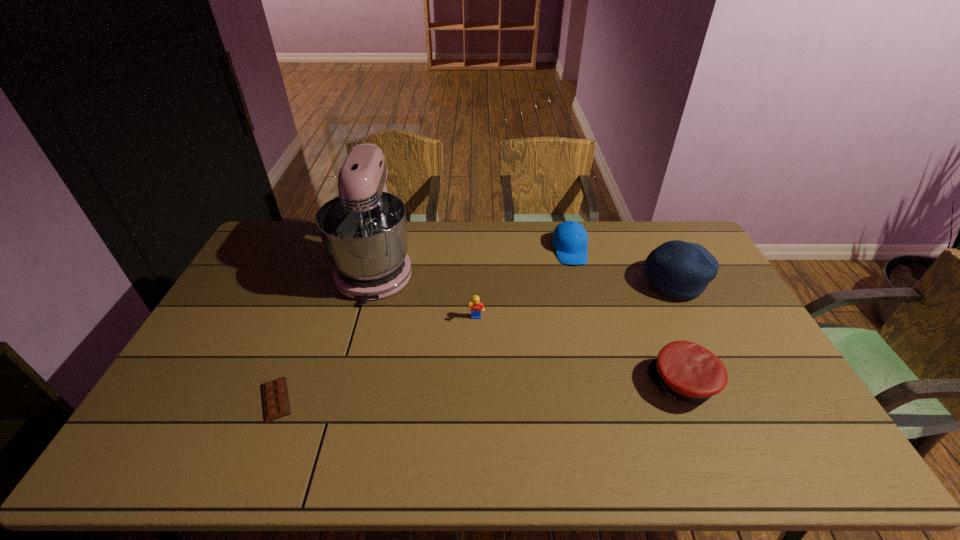
Where is `free location at the near edge`? This screenshot has width=960, height=540. free location at the near edge is located at coordinates (245, 463).

This screenshot has width=960, height=540. What are the coordinates of `vacant space at the left edge of the desktop` in the screenshot? It's located at (212, 361).

The width and height of the screenshot is (960, 540). Identify the location of vacant position at the right edge of the desktop. (700, 312).

Find the location of a particular element. vacant space that is in between the third object from left to right and the fifth shortest object is located at coordinates (574, 300).

What are the coordinates of `empty space that is in between the fourth object from right to left and the chocolate bar` in the screenshot? It's located at (376, 359).

Find the location of a particular element. free spot between the left cap and the nearer cap is located at coordinates (627, 316).

What are the coordinates of `empty space between the Lego and the right cap` in the screenshot? It's located at (580, 351).

The height and width of the screenshot is (540, 960). Identify the location of empty space that is in between the fourth farthest object and the skullcap. (574, 300).

Where is `free spot between the right cap and the chocolate bar`? This screenshot has width=960, height=540. free spot between the right cap and the chocolate bar is located at coordinates (480, 392).

Locate an element on the screen. unoccupied area between the right cap and the fifth shortest object is located at coordinates (678, 333).